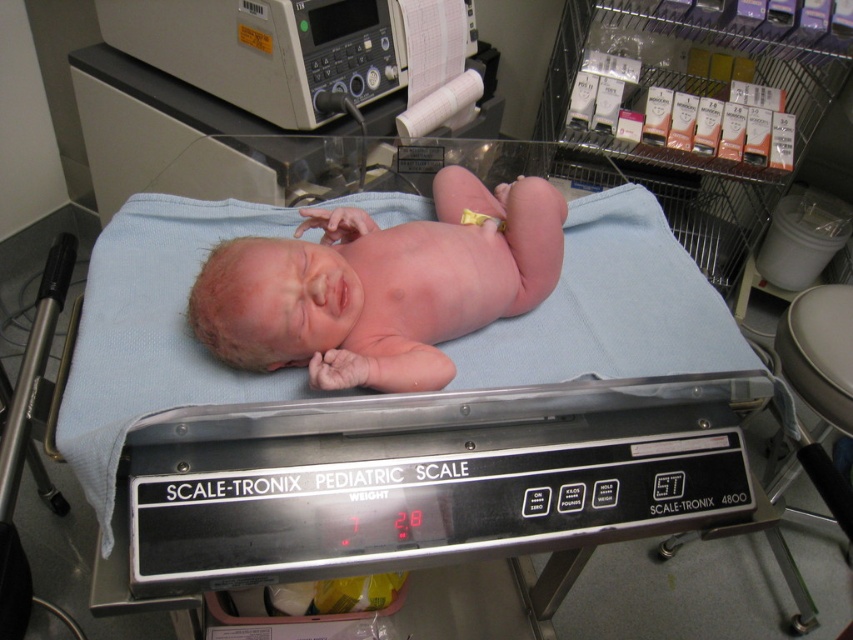
Question: Can you confirm if blue fabric hospital bed at center is smaller than pink smooth skin at center?

Choices:
 (A) no
 (B) yes

Answer: (A)

Question: Does gray plastic monitor at upper left appear under yellow fabric diaper at center?

Choices:
 (A) no
 (B) yes

Answer: (A)

Question: Which point appears farthest from the camera in this image?

Choices:
 (A) (543, 250)
 (B) (480, 216)
 (C) (242, 92)

Answer: (C)

Question: Estimate the real-world distances between objects in this image. Which object is farther from the pink smooth skin at center?

Choices:
 (A) blue fabric hospital bed at center
 (B) gray plastic monitor at upper left
 (C) yellow fabric diaper at center

Answer: (B)

Question: Is blue fabric hospital bed at center smaller than yellow fabric diaper at center?

Choices:
 (A) no
 (B) yes

Answer: (A)

Question: Which is farther from the yellow fabric diaper at center?

Choices:
 (A) blue fabric hospital bed at center
 (B) pink smooth skin at center
 (C) gray plastic monitor at upper left

Answer: (C)